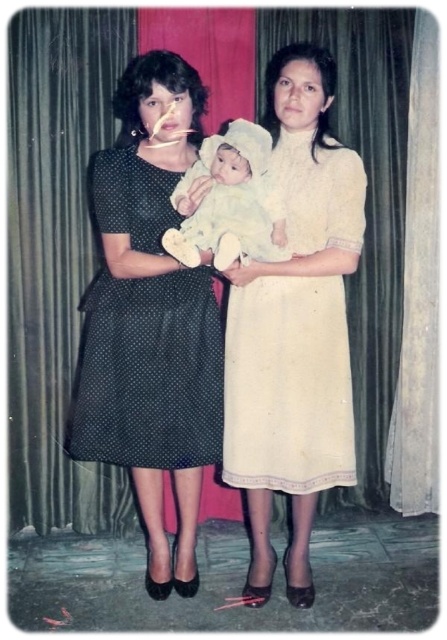
Consider the image. You are standing in the room and want to hand a gift to the person wearing the creamy soft fabric dress at center. The gift is 2 feet in length. Can you reach them without moving closer than 6 feet?

The creamy soft fabric dress at center is 6.59 feet away from viewer. Since the gift is 2 feet long, you can extend your arm to reach them as the distance is within the 6 feet requirement.